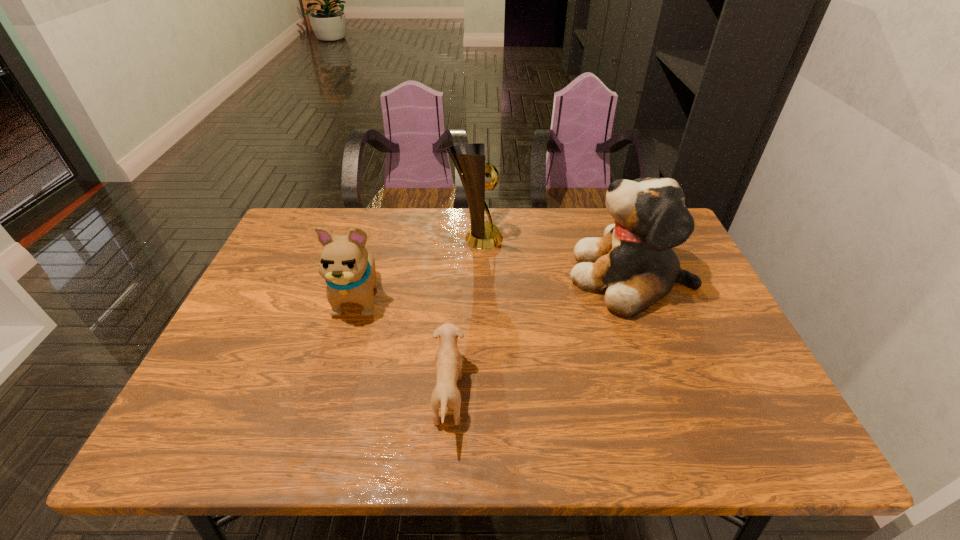
At what (x,y) coordinates should I click in order to perform the action: click on vacant space situated 0.170m on the face of the leftmost puppy. Please return your answer as a coordinate pair (x, y). Looking at the image, I should click on (334, 383).

At what (x,y) coordinates should I click in order to perform the action: click on vacant space situated on the left side of the second puppy from right to left. Please return your answer as a coordinate pair (x, y). This screenshot has width=960, height=540. Looking at the image, I should click on (614, 397).

The width and height of the screenshot is (960, 540). I want to click on award at the far edge, so point(471,168).

This screenshot has height=540, width=960. In order to click on puppy present at the far edge in this screenshot , I will do `click(633, 263)`.

Find the location of `object that is at the near edge`. object that is at the near edge is located at coordinates (x=448, y=362).

Where is `object that is positioned at the right edge`? The width and height of the screenshot is (960, 540). object that is positioned at the right edge is located at coordinates (633, 263).

Identify the location of object situated at the far right corner. This screenshot has height=540, width=960. (633, 263).

The height and width of the screenshot is (540, 960). I want to click on vacant space at the far edge, so click(564, 238).

Identify the location of free space at the near edge of the desktop. The width and height of the screenshot is (960, 540). (322, 441).

In the image, there is a desktop. At what (x,y) coordinates should I click in order to perform the action: click on vacant space at the left edge. Please return your answer as a coordinate pair (x, y). Looking at the image, I should click on (269, 293).